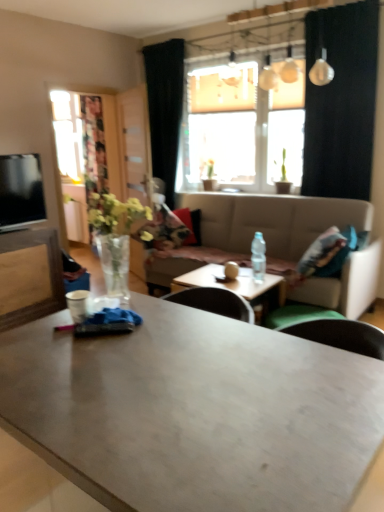
I want to click on free space in front of clear plastic bottle at table center, so click(259, 286).